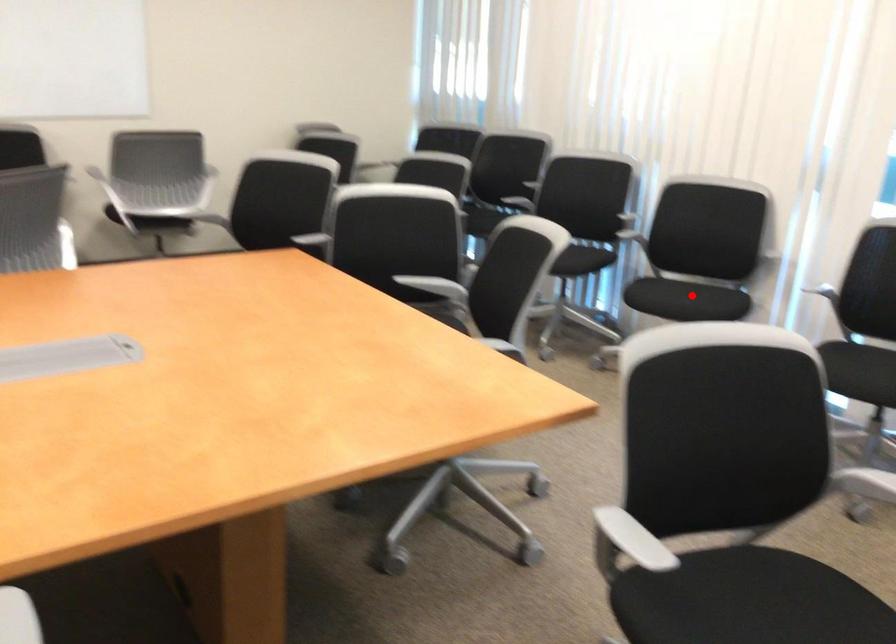
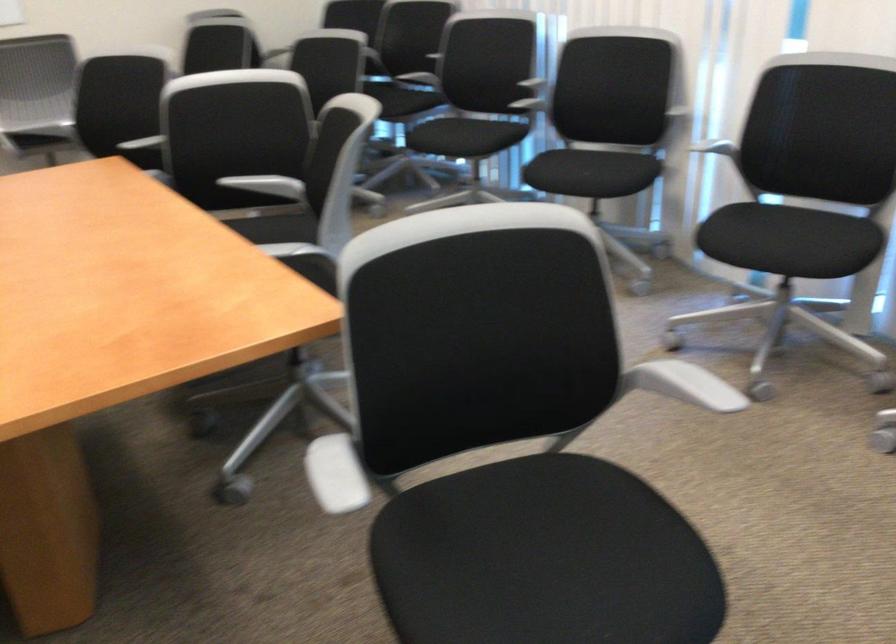
Question: I am providing you with two images of the same scene from different viewpoints. A red point is shown in image1. For the corresponding object point in image2, is it positioned nearer or farther from the camera?

Choices:
 (A) Nearer
 (B) Farther

Answer: (A)